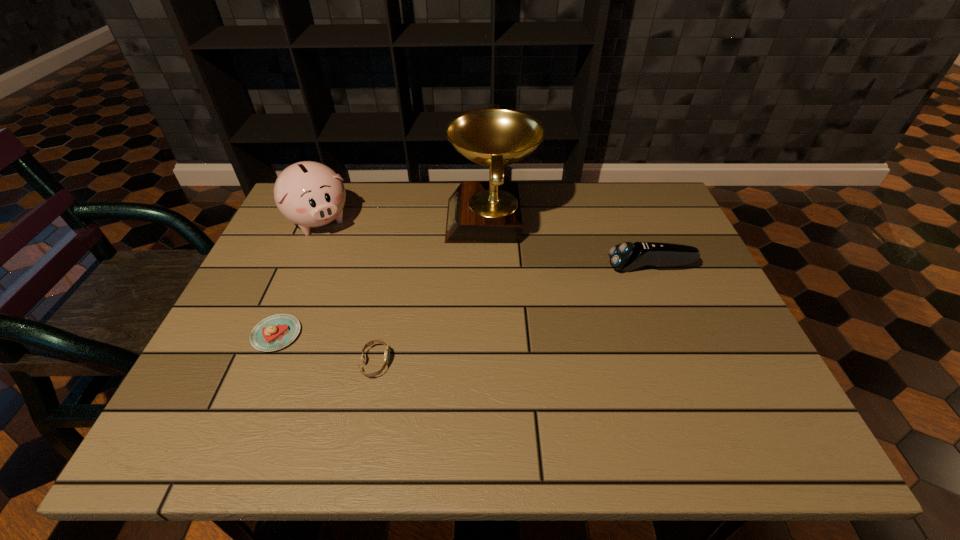
You are a GUI agent. You are given a task and a screenshot of the screen. Output one action in this format:
    pyautogui.click(x=<x>, y=<y>)
    Task: Click on the vacant region located on the right of the fourth shortest object
    This screenshot has height=540, width=960.
    Given the screenshot: What is the action you would take?
    click(390, 221)

At what (x,y) coordinates should I click in order to perform the action: click on free location located on the head of the rightmost object. Please return your answer as a coordinate pair (x, y). The height and width of the screenshot is (540, 960). Looking at the image, I should click on (535, 267).

Locate an element on the screen. free region located 0.340m on the head of the rightmost object is located at coordinates (476, 267).

I want to click on vacant region located on the head of the rightmost object, so coord(516,267).

The image size is (960, 540). In order to click on vacant space located on the face of the third object from right to left in this screenshot , I will do `click(546, 362)`.

The width and height of the screenshot is (960, 540). I want to click on free region located 0.090m on the back of the pastry, so click(x=296, y=289).

Where is `award at the far edge`? award at the far edge is located at coordinates (478, 212).

Find the location of a particular element. The height and width of the screenshot is (540, 960). piggy bank that is at the far edge is located at coordinates (310, 194).

Image resolution: width=960 pixels, height=540 pixels. What are the coordinates of `piggy bank positioned at the left edge` in the screenshot? It's located at (x=310, y=194).

You are a GUI agent. You are given a task and a screenshot of the screen. Output one action in this format:
    pyautogui.click(x=<x>, y=<y>)
    Task: Click on the pastry present at the left edge
    
    Given the screenshot: What is the action you would take?
    pyautogui.click(x=277, y=331)